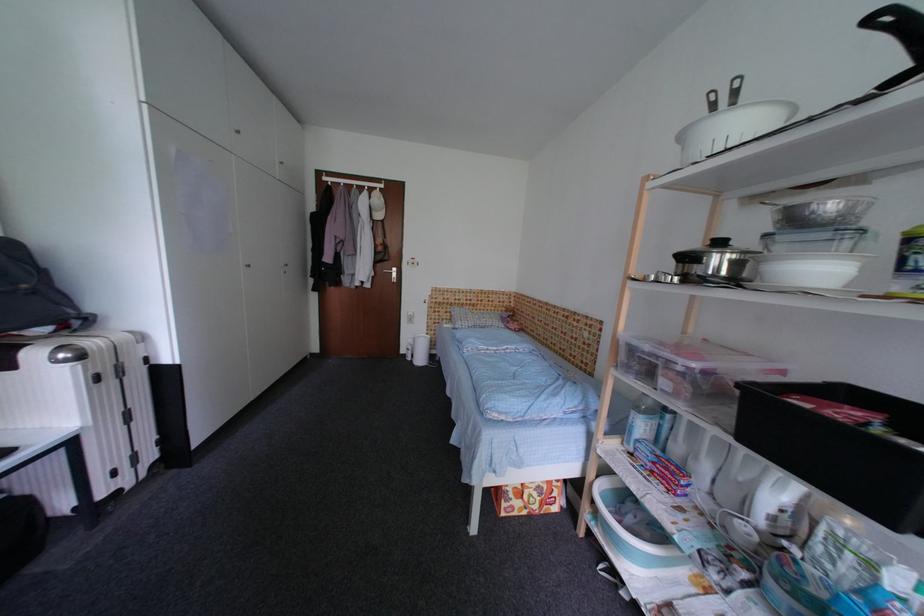
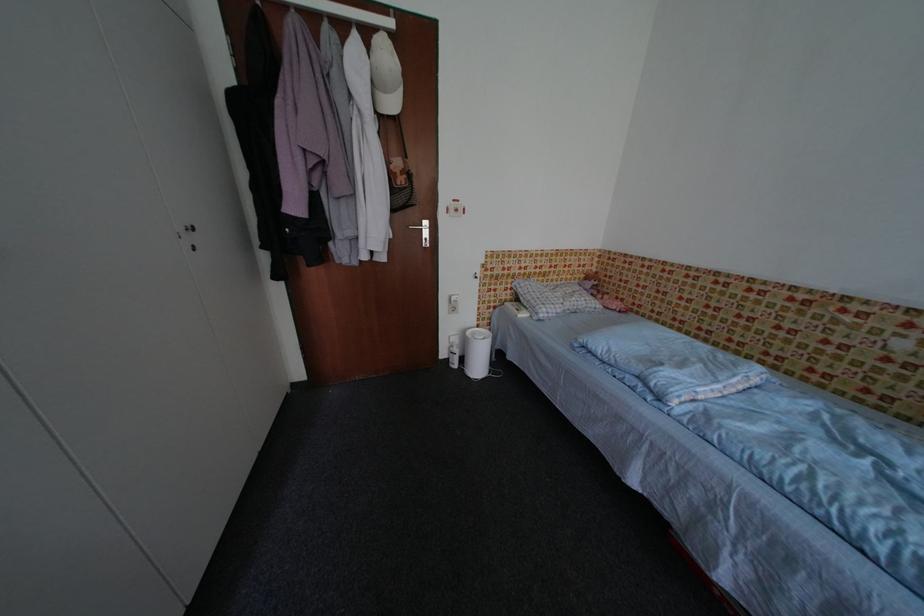
Where in the second image is the point corresponding to (419,342) from the first image?

(464, 342)